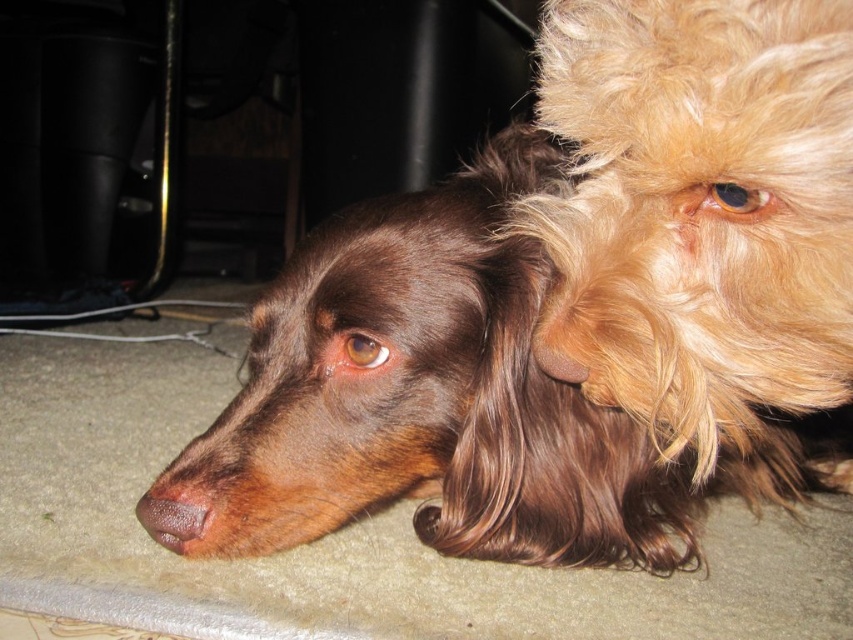
You are standing in the living room and want to place a new rug exactly at the position where the brown shiny fur dog at center is currently resting. What are the coordinates of that location?

The coordinates of the position where the brown shiny fur dog at center is resting are at point (x=450, y=397).